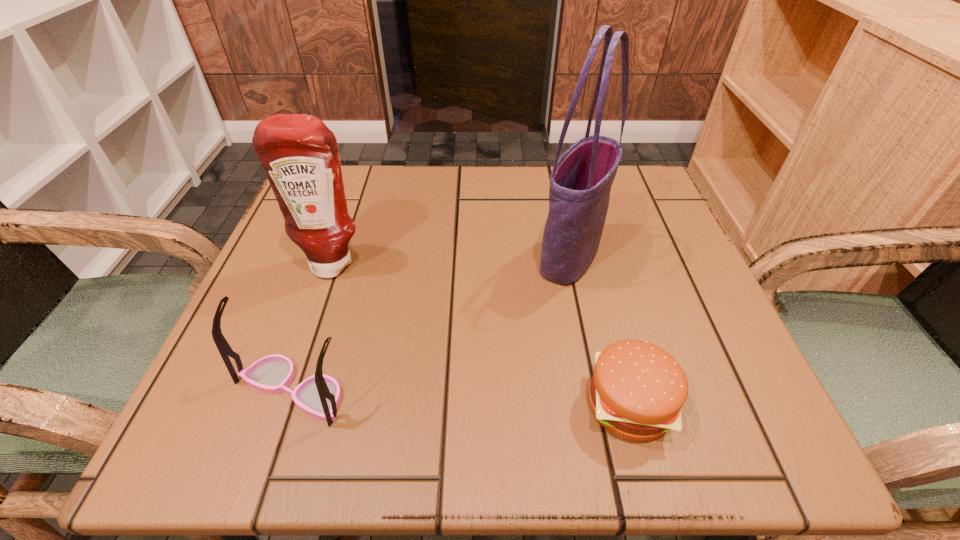
The image size is (960, 540). In order to click on hamburger that is positioned at the near edge in this screenshot , I will do point(637,389).

Image resolution: width=960 pixels, height=540 pixels. Identify the location of condiment that is at the left edge. (299, 153).

Find the location of a particular element. Image resolution: width=960 pixels, height=540 pixels. spectacles located in the left edge section of the desktop is located at coordinates (319, 395).

Locate an element on the screen. Image resolution: width=960 pixels, height=540 pixels. tote bag that is at the right edge is located at coordinates (580, 182).

Where is `hamburger that is at the right edge`? The width and height of the screenshot is (960, 540). hamburger that is at the right edge is located at coordinates (637, 389).

The image size is (960, 540). Identify the location of object located in the near left corner section of the desktop. (319, 395).

The height and width of the screenshot is (540, 960). In order to click on object at the far right corner in this screenshot , I will do `click(580, 182)`.

The width and height of the screenshot is (960, 540). I want to click on object positioned at the near right corner, so click(637, 389).

In the image, there is a desktop. Find the location of `free space at the far edge`. free space at the far edge is located at coordinates (488, 187).

This screenshot has height=540, width=960. What are the coordinates of `vacant area at the near edge of the desktop` in the screenshot? It's located at (340, 411).